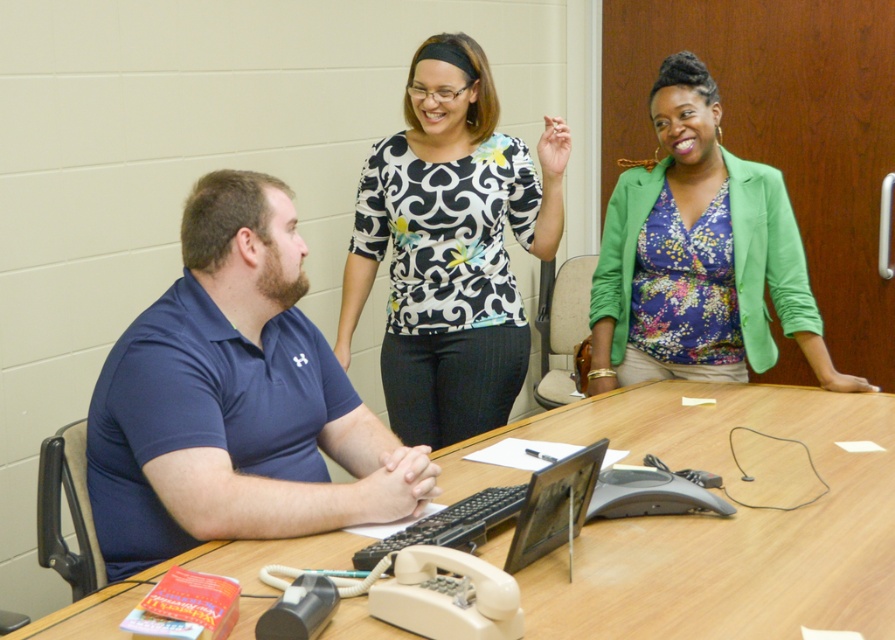
Question: Is wooden table at center positioned in front of black and white printed blouse at center?

Choices:
 (A) yes
 (B) no

Answer: (A)

Question: Which object is the farthest from the blue cotton polo shirt at center?

Choices:
 (A) black and white printed blouse at center
 (B) floral fabric blouse at upper right
 (C) wooden table at center

Answer: (B)

Question: Which point is farther to the camera?

Choices:
 (A) floral fabric blouse at upper right
 (B) wooden table at center

Answer: (A)

Question: Which point is closer to the camera?

Choices:
 (A) blue cotton polo shirt at center
 (B) wooden table at center

Answer: (B)

Question: Is blue cotton polo shirt at center smaller than black and white printed blouse at center?

Choices:
 (A) no
 (B) yes

Answer: (B)

Question: Does wooden table at center have a greater width compared to black and white printed blouse at center?

Choices:
 (A) no
 (B) yes

Answer: (B)